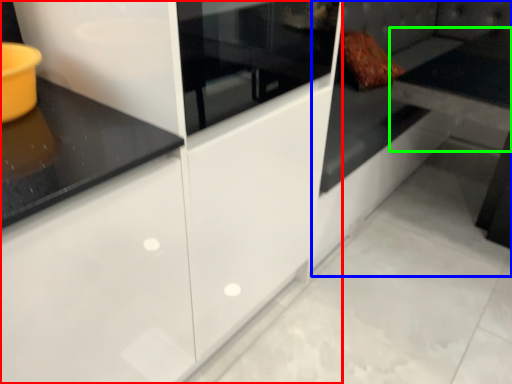
Question: Considering the real-world distances, which object is farthest from cabinetry (highlighted by a red box)? couch (highlighted by a blue box) or table (highlighted by a green box)?

Choices:
 (A) couch
 (B) table

Answer: (B)